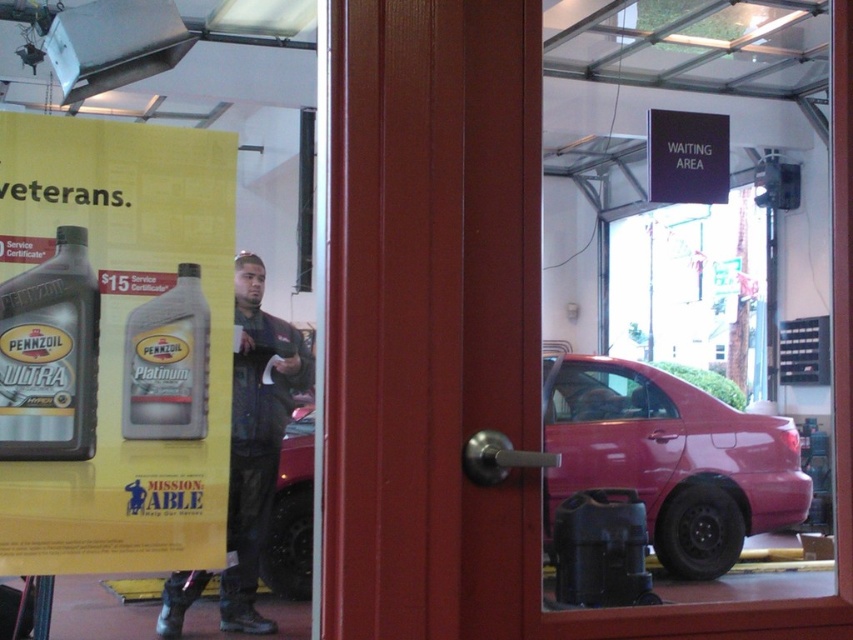
You are a mechanic working in the service center. You need to reach the matte black oil can at left to lubricate the matte red car at center. Which object is lower in position so you can access it first?

The matte red car at center is lower in position than the matte black oil can at left, so you can access it first.